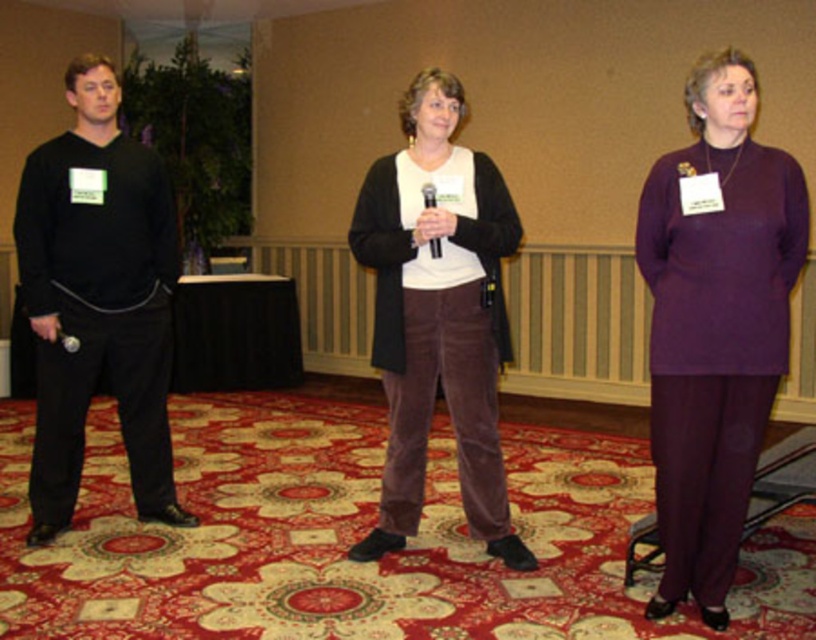
You are organizing a fashion show and need to arrange the purple matte pants at center and black matte pants at left based on their sizes. Which should be placed first if you want to arrange them from smallest to largest?

The purple matte pants at center should be placed first because they are smaller than the black matte pants at left.

You are an event organizer who needs to ensure all items are appropriately sized for the event. Given the black matte pants at left and the matte black microphone at lower left, which item requires more storage space?

The black matte pants at left requires more storage space because it has a larger size compared to the matte black microphone at lower left.

Where is the black matte pants at left located in the image?

The black matte pants at left is located at point (96, 298) in the image.